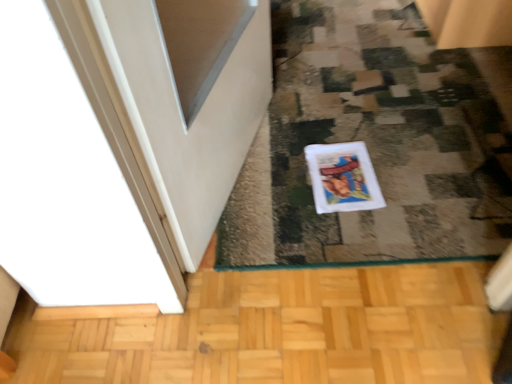
Describe the element at coordinates (343, 177) in the screenshot. Image resolution: width=512 pixels, height=384 pixels. I see `white matte comic book at center` at that location.

Locate an element on the screen. white matte comic book at center is located at coordinates (343, 177).

The width and height of the screenshot is (512, 384). Describe the element at coordinates (374, 143) in the screenshot. I see `white fabric doormat at center` at that location.

Measure the distance between point (x=298, y=173) and camera.

The distance of point (x=298, y=173) from camera is 1.42 meters.

The height and width of the screenshot is (384, 512). I want to click on white fabric doormat at center, so click(x=374, y=143).

Where is `white matte comic book at center`? Image resolution: width=512 pixels, height=384 pixels. white matte comic book at center is located at coordinates (343, 177).

Does white matte comic book at center appear on the right side of white fabric doormat at center?

Incorrect, white matte comic book at center is not on the right side of white fabric doormat at center.

Considering the relative positions of white matte comic book at center and white fabric doormat at center in the image provided, is white matte comic book at center in front of white fabric doormat at center?

No, white matte comic book at center is further to the viewer.

Does point (360, 168) come behind point (443, 118)?

No, (360, 168) is closer to viewer.

From the image's perspective, is white matte comic book at center above white fabric doormat at center?

No.

From a real-world perspective, which object rests below the other?

From a 3D spatial view, white matte comic book at center is below.

Which object is thinner, white matte comic book at center or white fabric doormat at center?

white matte comic book at center is thinner.

Can you confirm if white matte comic book at center is shorter than white fabric doormat at center?

Yes, white matte comic book at center is shorter than white fabric doormat at center.

Does white matte comic book at center have a larger size compared to white fabric doormat at center?

No, white matte comic book at center is not bigger than white fabric doormat at center.

Would you say white matte comic book at center is inside or outside white fabric doormat at center?

The correct answer is: inside.

Is white matte comic book at center positioned far away from white fabric doormat at center?

white matte comic book at center is near white fabric doormat at center, not far away.

Could you tell me if white matte comic book at center is turned towards white fabric doormat at center?

Yes, white matte comic book at center is aimed at white fabric doormat at center.

Image resolution: width=512 pixels, height=384 pixels. Identify the location of comic book on the left side of white fabric doormat at center. (343, 177).

Is white fabric doormat at center at the right side of white matte comic book at center?

Indeed, white fabric doormat at center is positioned on the right side of white matte comic book at center.

Relative to white matte comic book at center, is white fabric doormat at center in front or behind?

Visually, white fabric doormat at center is located in front of white matte comic book at center.

Does point (488, 254) appear closer or farther from the camera than point (357, 198)?

Point (488, 254) appears to be closer to the viewer than point (357, 198).

From the image's perspective, is white fabric doormat at center above or below white matte comic book at center?

white fabric doormat at center is above white matte comic book at center.

From a real-world perspective, is white fabric doormat at center physically below white matte comic book at center?

Answer: No.

Which of these two, white fabric doormat at center or white matte comic book at center, is thinner?

white matte comic book at center is thinner.

Is white fabric doormat at center shorter than white matte comic book at center?

Incorrect, the height of white fabric doormat at center does not fall short of that of white matte comic book at center.

Which of these two, white fabric doormat at center or white matte comic book at center, is bigger?

With larger size is white fabric doormat at center.

Is white fabric doormat at center located outside white matte comic book at center?

Indeed, white fabric doormat at center is completely outside white matte comic book at center.

Are white fabric doormat at center and white matte comic book at center located far from each other?

No, white fabric doormat at center is in close proximity to white matte comic book at center.

Is white fabric doormat at center looking in the opposite direction of white matte comic book at center?

white fabric doormat at center does not have its back to white matte comic book at center.

How far apart are white fabric doormat at center and white matte comic book at center?

white fabric doormat at center is 8.84 inches from white matte comic book at center.

At what (x,y) coordinates should I click in order to perform the action: click on doormat that appears above the white matte comic book at center (from the image's perspective). Please return your answer as a coordinate pair (x, y). Image resolution: width=512 pixels, height=384 pixels. Looking at the image, I should click on (374, 143).

This screenshot has height=384, width=512. Identify the location of doormat that is on the right side of white matte comic book at center. (374, 143).

Where is `comic book on the left of the white fabric doormat at center`? comic book on the left of the white fabric doormat at center is located at coordinates (343, 177).